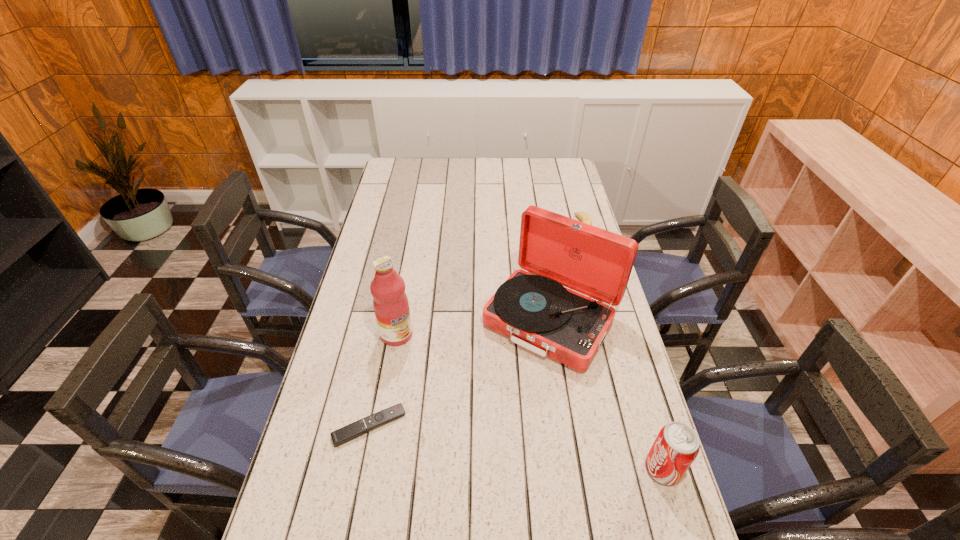
At what (x,y) coordinates should I click in order to perform the action: click on free spot between the fruit juice and the shortest object. Please return your answer as a coordinate pair (x, y). This screenshot has width=960, height=540. Looking at the image, I should click on (383, 380).

Locate an element on the screen. free spot between the fruit juice and the fourth farthest object is located at coordinates click(383, 380).

Find the location of a particular element. The image size is (960, 540). free point between the fruit juice and the phonograph_record is located at coordinates (474, 328).

Where is `free space between the third shortest object and the second shortest object`? This screenshot has width=960, height=540. free space between the third shortest object and the second shortest object is located at coordinates (618, 348).

At what (x,y) coordinates should I click in order to perform the action: click on free spot between the farthest object and the nearest object. Please return your answer as a coordinate pair (x, y). Looking at the image, I should click on (618, 348).

In order to click on unoccupied position between the soda can and the remote control in this screenshot , I will do `click(516, 447)`.

Image resolution: width=960 pixels, height=540 pixels. I want to click on free space between the fruit juice and the nearest object, so click(x=530, y=402).

Locate an element on the screen. This screenshot has height=540, width=960. vacant space that is in between the third shortest object and the fruit juice is located at coordinates (530, 402).

Locate which object is the fourth closest to the fruit juice. Please provide its 2D coordinates. Your answer should be formatted as a tuple, i.e. [(x, y)], where the tuple contains the x and y coordinates of a point satisfying the conditions above.

[(677, 445)]

Image resolution: width=960 pixels, height=540 pixels. I want to click on object that is the third nearest to the fourth farthest object, so click(x=677, y=445).